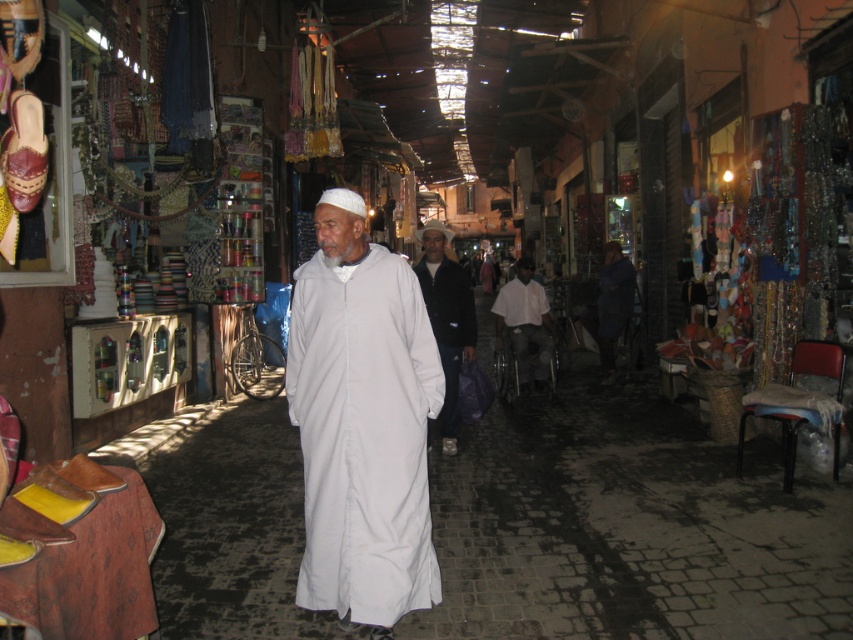
Question: Estimate the real-world distances between objects in this image. Which object is closer to the white matte/soft robe at center?

Choices:
 (A) white matte clothing at center
 (B) white cotton shirt at center
 (C) white cotton robe at center

Answer: (A)

Question: Can you confirm if white matte/soft robe at center is bigger than white cotton shirt at center?

Choices:
 (A) no
 (B) yes

Answer: (B)

Question: Among these points, which one is nearest to the camera?

Choices:
 (A) (318, 291)
 (B) (421, 259)
 (C) (613, 337)

Answer: (A)

Question: Is white matte clothing at center further to camera compared to white cotton shirt at center?

Choices:
 (A) no
 (B) yes

Answer: (A)

Question: Which point is farther to the camera?

Choices:
 (A) (456, 365)
 (B) (384, 467)
 (C) (616, 291)

Answer: (C)

Question: Can you confirm if white matte clothing at center is thinner than white cotton robe at center?

Choices:
 (A) yes
 (B) no

Answer: (B)